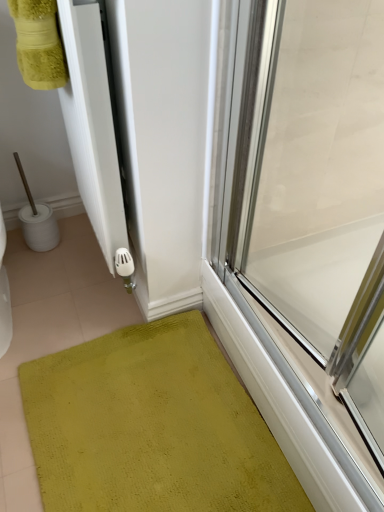
Question: Relative to transparent glass door at right, is green textured bath mat at lower left in front or behind?

Choices:
 (A) behind
 (B) front

Answer: (A)

Question: Would you say green textured bath mat at lower left is to the left or to the right of transparent glass door at right in the picture?

Choices:
 (A) right
 (B) left

Answer: (B)

Question: Is green textured bath mat at lower left inside the boundaries of transparent glass door at right, or outside?

Choices:
 (A) outside
 (B) inside

Answer: (A)

Question: Considering the positions of transparent glass door at right and green textured bath mat at lower left in the image, is transparent glass door at right wider or thinner than green textured bath mat at lower left?

Choices:
 (A) thin
 (B) wide

Answer: (A)

Question: Relative to green textured bath mat at lower left, is transparent glass door at right in front or behind?

Choices:
 (A) behind
 (B) front

Answer: (B)

Question: Based on their positions, is transparent glass door at right located to the left or right of green textured bath mat at lower left?

Choices:
 (A) right
 (B) left

Answer: (A)

Question: Considering the positions of point (339, 438) and point (228, 457), is point (339, 438) closer or farther from the camera than point (228, 457)?

Choices:
 (A) farther
 (B) closer

Answer: (B)